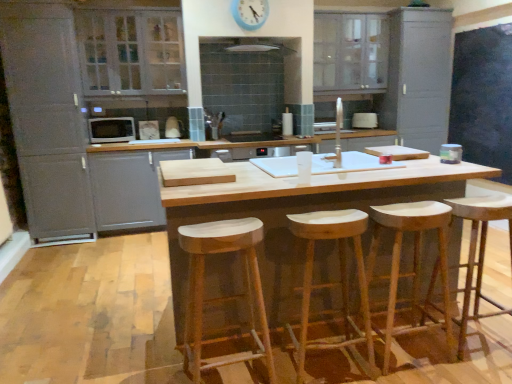
Locate an element on the screen. The height and width of the screenshot is (384, 512). free point in front of matte gray cabinet at left, arranged as the 3th cabinetry when viewed from the left is located at coordinates (114, 250).